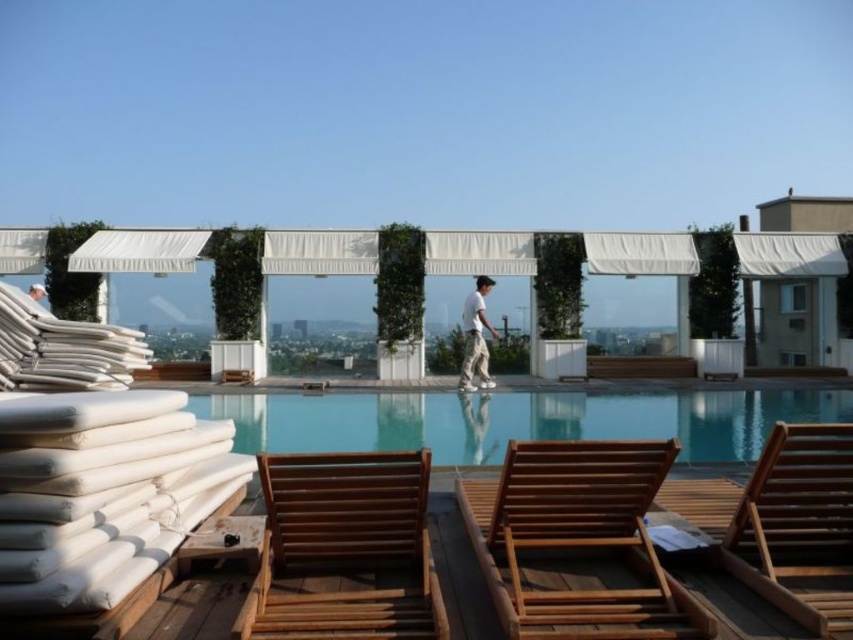
Which is above, wooden lounge chair at center or white cotton pants at center?

Positioned higher is white cotton pants at center.

Which is in front, point (659, 456) or point (461, 378)?

Point (659, 456)

Does point (569, 579) come behind point (485, 307)?

No, (569, 579) is in front of (485, 307).

Find the location of `wooden lounge chair at center`. wooden lounge chair at center is located at coordinates (577, 541).

Between point (614, 589) and point (320, 541), which one is positioned in front?

Point (614, 589) is more forward.

What do you see at coordinates (577, 541) in the screenshot?
I see `wooden lounge chair at center` at bounding box center [577, 541].

I want to click on wooden lounge chair at center, so click(577, 541).

In the scene shown: Does wooden lounge chair at center lie in front of white fabric building at upper right?

Yes.

Is point (567, 614) positioned in front of point (817, 355)?

That is True.

Where is `wooden lounge chair at center`? wooden lounge chair at center is located at coordinates (577, 541).

Where is `wooden lounge chair at center`? wooden lounge chair at center is located at coordinates (577, 541).